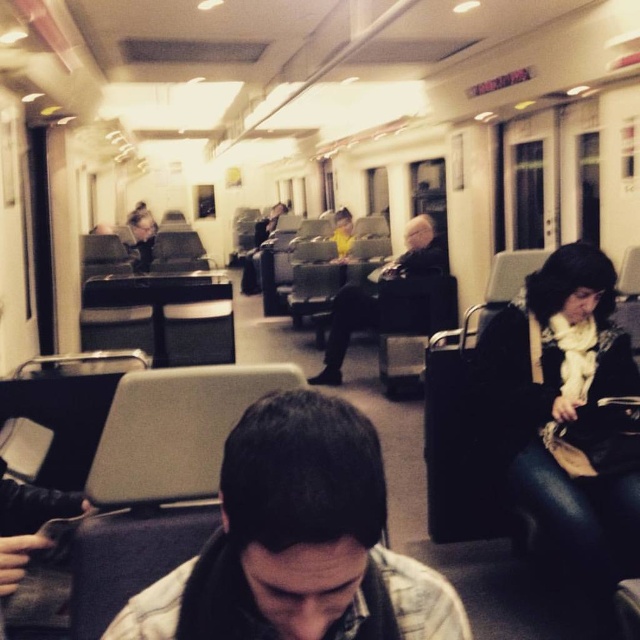
You are a passenger on a train and need to place your black leather jacket at right and dark gray fabric jacket at center on the seat. Which jacket can you place first without overlapping the other?

The black leather jacket at right has a lesser width compared to the dark gray fabric jacket at center, so you can place the black leather jacket at right first since it takes up less space.

You are a passenger on a train and want to place your backpack on the floor. The backpack requires 30 inches of space. Is the area near point (x=140, y=600) sufficient?

The area near point (x=140, y=600) is 33.66 inches from the camera, which is more than enough space for the backpack requiring 30 inches.